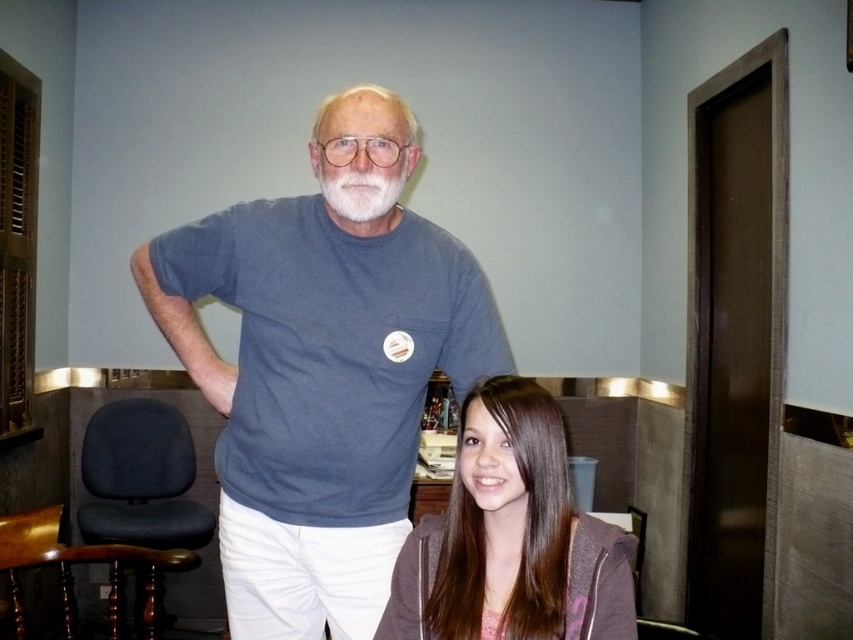
You are a photographer trying to capture the smooth brown hair at lower center. The camera is focused at point [511,536]. Is the point where the camera is focused exactly where the smooth brown hair at lower center is located?

Yes, the point [511,536] indicates the location of the smooth brown hair at lower center, so the camera is focused exactly on it.

You are standing in the room and want to hand a book to the person with smooth brown hair at lower center. If you can reach up to 3 feet, will you be able to reach them?

The smooth brown hair at lower center is 3.70 feet away from the viewer, which is beyond your reach of 3 feet. You will not be able to reach them.